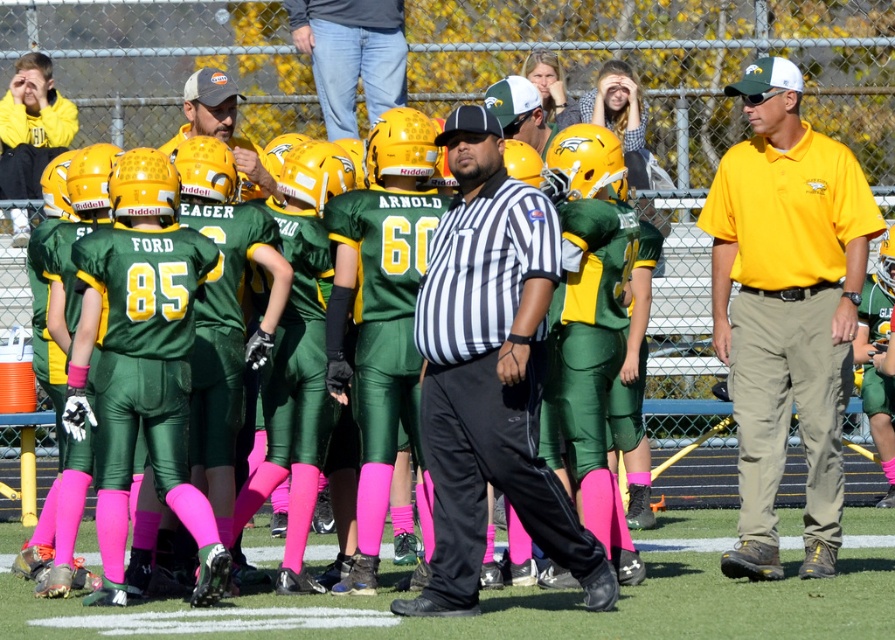
Between yellow cotton shirt at center and pink fabric socks at lower center, which one is positioned lower?

pink fabric socks at lower center

Which of these two, yellow cotton shirt at center or pink fabric socks at lower center, stands shorter?

pink fabric socks at lower center is shorter.

What do you see at coordinates (786, 308) in the screenshot? The image size is (895, 640). I see `yellow cotton shirt at center` at bounding box center [786, 308].

The image size is (895, 640). Identify the location of yellow cotton shirt at center. (786, 308).

Who is more forward, (456, 208) or (798, 269)?

Point (456, 208) is in front.

Which of these two, green matte uniform at center or yellow cotton shirt at center, stands shorter?

green matte uniform at center is shorter.

This screenshot has width=895, height=640. Find the location of `green matte uniform at center`. green matte uniform at center is located at coordinates (489, 360).

Can you confirm if matte yellow helmet at upper left is positioned above matte gray cap at center?

Yes.

What do you see at coordinates (31, 125) in the screenshot? I see `matte yellow helmet at upper left` at bounding box center [31, 125].

Between point (60, 118) and point (270, 182), which one is positioned in front?

Point (270, 182) is in front.

You are a GUI agent. You are given a task and a screenshot of the screen. Output one action in this format:
    pyautogui.click(x=<x>, y=<y>)
    Task: Click on the matte yellow helmet at upper left
    This screenshot has width=895, height=640.
    Given the screenshot: What is the action you would take?
    pyautogui.click(x=31, y=125)